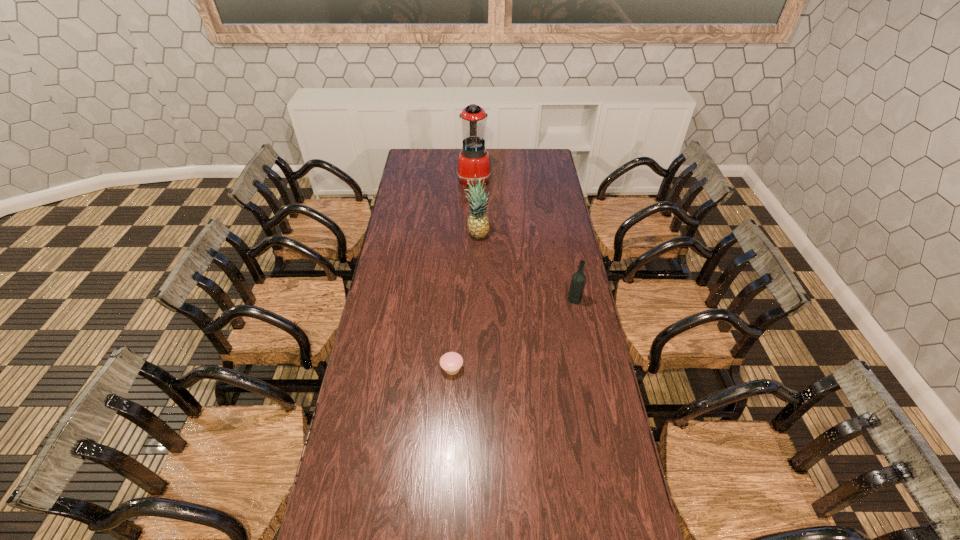
Find the location of `free space located on the back of the third farthest object`. free space located on the back of the third farthest object is located at coordinates (569, 271).

Identify the location of vacant space located 0.310m on the front of the cupcake. Image resolution: width=960 pixels, height=540 pixels. (446, 464).

At what (x,y) coordinates should I click in order to perform the action: click on object situated at the far edge. Please return your answer as a coordinate pair (x, y). The image size is (960, 540). Looking at the image, I should click on (473, 159).

Locate an element on the screen. This screenshot has height=540, width=960. object at the right edge is located at coordinates (578, 280).

This screenshot has height=540, width=960. What are the coordinates of `vacant position at the far edge of the desktop` in the screenshot? It's located at (452, 162).

At what (x,y) coordinates should I click in order to perform the action: click on blank space at the left edge. Please return your answer as a coordinate pair (x, y). Looking at the image, I should click on (402, 219).

In the image, there is a desktop. In order to click on free space at the right edge in this screenshot , I will do `click(628, 517)`.

Locate an element on the screen. free location at the far left corner is located at coordinates (427, 163).

Identify the location of free area in between the rightmost object and the shortest object. This screenshot has width=960, height=540. (514, 334).

At what (x,y) coordinates should I click in order to perform the action: click on vacant space that is in between the cupcake and the food processor. Please return your answer as a coordinate pair (x, y). The height and width of the screenshot is (540, 960). Looking at the image, I should click on (463, 273).